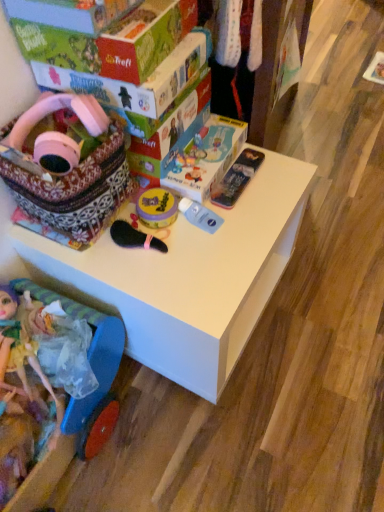
The height and width of the screenshot is (512, 384). I want to click on vacant space situated on the left part of transparent plastic bottle at center, positioned as the fifth toy in left-to-right order, so click(x=140, y=249).